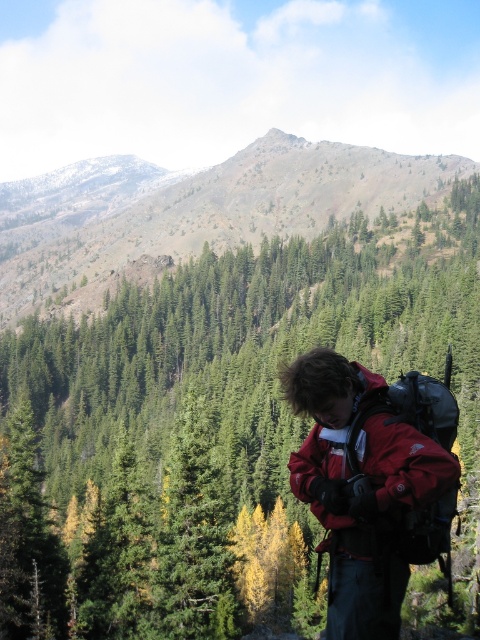
You are a hiker looking at the green textured pine tree at center and the matte red jacket at center. Which object is located to the left of the other?

The green textured pine tree at center is positioned on the left side of matte red jacket at center.

You are the hiker in the image. You notice a green textured pine tree at center and a green textured forest at center. Which one is nearer to you?

The green textured pine tree at center is closer to you than the green textured forest at center.

Where is the green textured forest at center located in the image?

The green textured forest at center is located at point (192, 211).